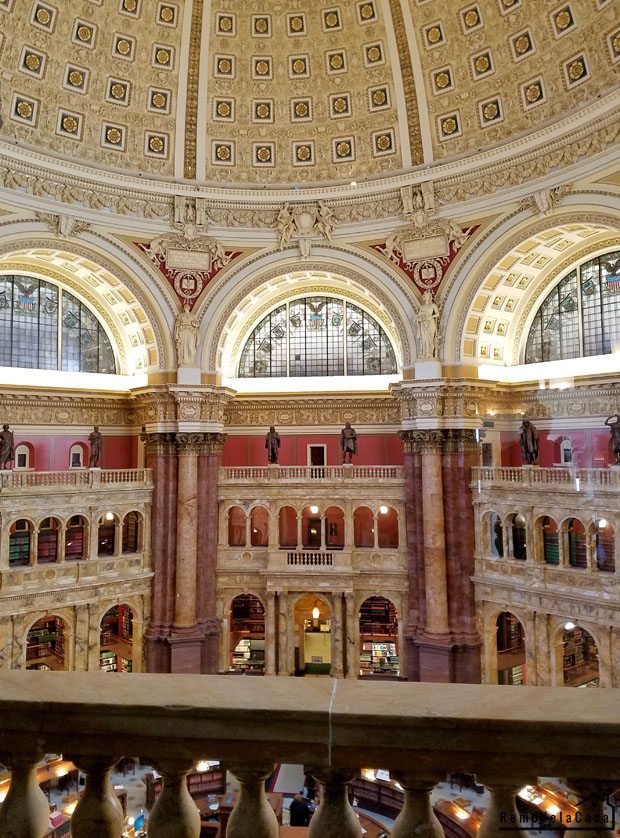
Where is `decorative window`? decorative window is located at coordinates (23, 339), (327, 339), (590, 316).